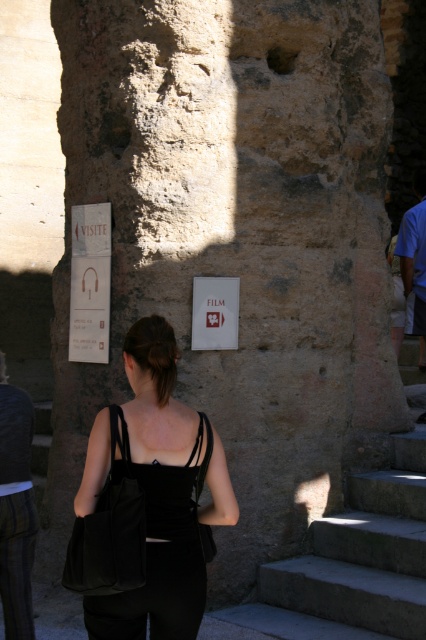
Who is more distant from viewer, (201, 488) or (198, 289)?

Positioned behind is point (198, 289).

Who is lower down, black fabric bag at center or white paper sign at center?

black fabric bag at center is lower down.

The height and width of the screenshot is (640, 426). I want to click on black fabric bag at center, so click(146, 502).

The image size is (426, 640). What are the coordinates of `black fabric bag at center` in the screenshot? It's located at (x=146, y=502).

Between point (129, 556) and point (89, 321), which one is positioned behind?

The point (89, 321) is behind.

Based on the photo, who is more forward, (106, 536) or (104, 246)?

Point (106, 536)

From the picture: Who is more forward, (103, 420) or (77, 344)?

Point (103, 420) is in front.

Identify the location of black fabric bag at center. (146, 502).

Can you confirm if gray concrete stairs at lower right is bigger than matte white sign at left?

Yes.

Who is lower down, gray concrete stairs at lower right or matte white sign at left?

Positioned lower is gray concrete stairs at lower right.

The width and height of the screenshot is (426, 640). I want to click on gray concrete stairs at lower right, so click(x=348, y=566).